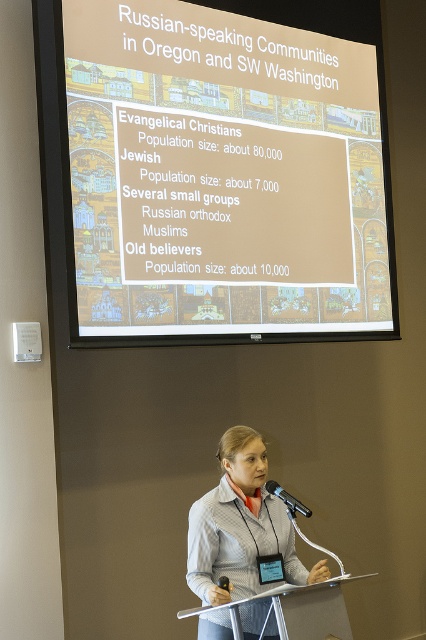
Does white matte projection screen at upper center come behind silver metallic podium at center?

That is True.

Is the position of white matte projection screen at upper center less distant than that of silver metallic podium at center?

No, white matte projection screen at upper center is behind silver metallic podium at center.

Who is more distant from viewer, (189, 106) or (264, 627)?

The point (189, 106) is more distant.

What are the coordinates of `white matte projection screen at upper center` in the screenshot? It's located at (229, 170).

Which is behind, point (160, 52) or point (227, 536)?

Positioned behind is point (160, 52).

Where is `white matte projection screen at upper center`? The width and height of the screenshot is (426, 640). white matte projection screen at upper center is located at coordinates (229, 170).

Locate an element on the screen. white matte projection screen at upper center is located at coordinates (229, 170).

Based on the photo, does gray fabric jacket at center come in front of black metallic microphone at center?

Yes, it is.

Between gray fabric jacket at center and black metallic microphone at center, which one appears on the right side from the viewer's perspective?

black metallic microphone at center

The height and width of the screenshot is (640, 426). What do you see at coordinates (241, 529) in the screenshot? I see `gray fabric jacket at center` at bounding box center [241, 529].

Find the location of a particular element. The image size is (426, 640). gray fabric jacket at center is located at coordinates (241, 529).